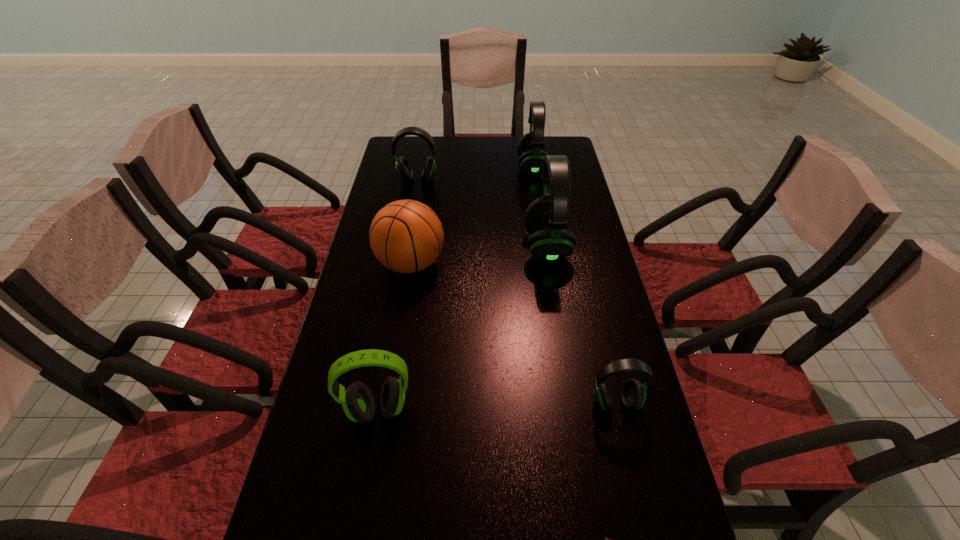
Locate an element on the screen. free space located on the ear cups of the third nearest headset is located at coordinates (444, 247).

Image resolution: width=960 pixels, height=540 pixels. I want to click on blank area located 0.210m on the ear cups of the third nearest headset, so click(457, 247).

The image size is (960, 540). Identify the location of blank area located 0.080m on the ear cups of the second tallest object. (496, 167).

Where is `vacant space situated 0.280m on the ear cups of the second tallest object`? vacant space situated 0.280m on the ear cups of the second tallest object is located at coordinates (445, 167).

The height and width of the screenshot is (540, 960). Identify the location of free region located on the ear cups of the second tallest object. (466, 167).

Image resolution: width=960 pixels, height=540 pixels. I want to click on vacant space located on the right of the basketball, so click(515, 264).

This screenshot has height=540, width=960. Find the location of `free space located 0.120m on the ear cups of the leftmost black headset`. free space located 0.120m on the ear cups of the leftmost black headset is located at coordinates click(x=413, y=206).

The height and width of the screenshot is (540, 960). Identify the location of vacant area situated on the right of the green headset. (468, 409).

Image resolution: width=960 pixels, height=540 pixels. What are the coordinates of `vacant space located on the ear cups of the shortest headset` in the screenshot? It's located at (628, 457).

The width and height of the screenshot is (960, 540). I want to click on object that is at the far edge, so click(532, 147).